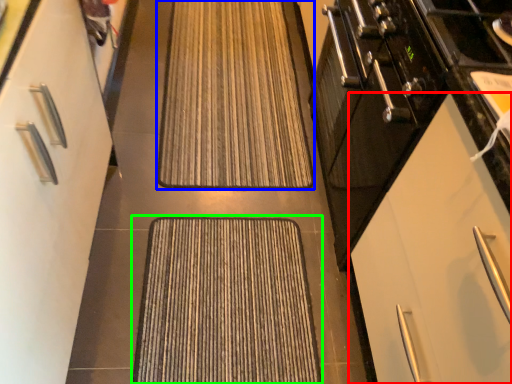
Question: Based on their relative distances, which object is farther from cabinetry (highlighted by a red box)? Choose from doormat (highlighted by a blue box) and doormat (highlighted by a green box).

Choices:
 (A) doormat
 (B) doormat

Answer: (A)